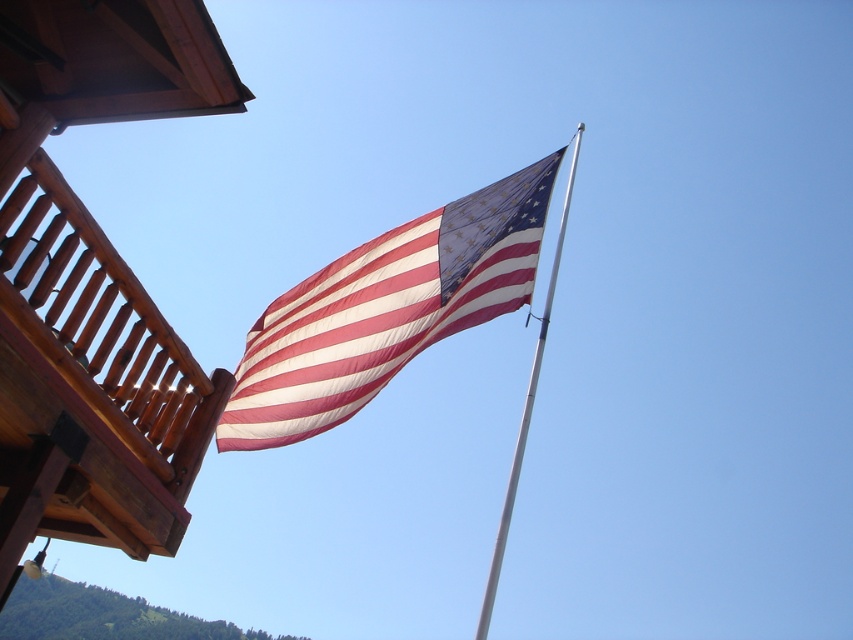
Is textured cotton flag at center positioned behind silver metallic flag pole at upper center?

Yes, textured cotton flag at center is further from the viewer.

Is textured cotton flag at center taller than silver metallic flag pole at upper center?

In fact, textured cotton flag at center may be shorter than silver metallic flag pole at upper center.

Between point (352, 362) and point (577, 144), which one is positioned behind?

The point (577, 144) is behind.

Locate an element on the screen. This screenshot has width=853, height=640. textured cotton flag at center is located at coordinates (386, 308).